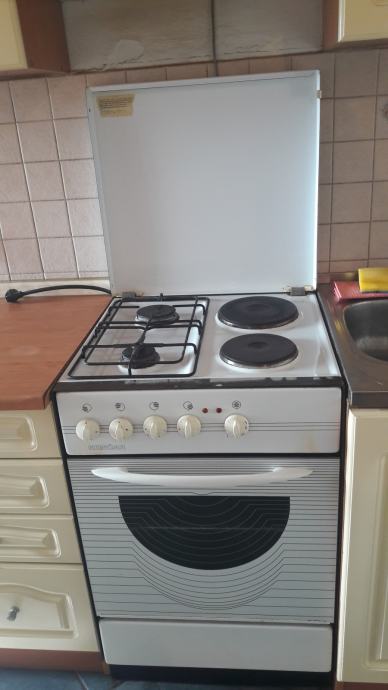
Identify the location of white kitchen drawer. The height and width of the screenshot is (690, 388). (37, 615).